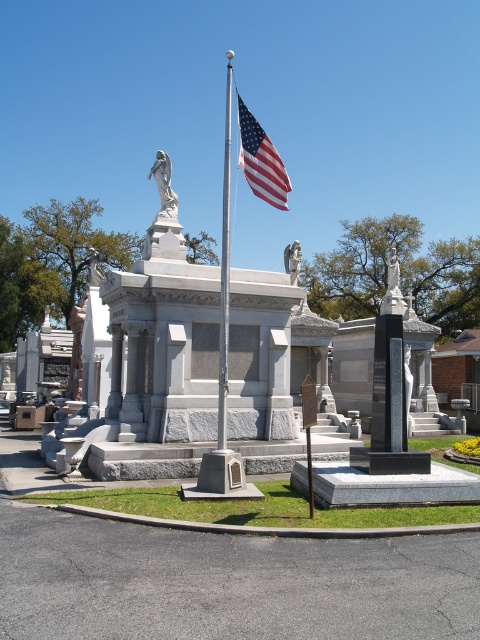
Can you confirm if white marble statue at upper center is positioned to the left of white marble statue at center?

Correct, you'll find white marble statue at upper center to the left of white marble statue at center.

Looking at this image, can you confirm if white marble statue at upper center is shorter than white marble statue at center?

Correct, white marble statue at upper center is not as tall as white marble statue at center.

Does point (169, 168) lie behind point (299, 262)?

No, it is not.

Identify the location of white marble statue at upper center. (164, 186).

Image resolution: width=480 pixels, height=640 pixels. Describe the element at coordinates (225, 272) in the screenshot. I see `polished metal flagpole at center` at that location.

Is polished metal flagpole at center bigger than white marble statue at upper center?

Yes, polished metal flagpole at center is bigger than white marble statue at upper center.

Describe the element at coordinates (225, 272) in the screenshot. I see `polished metal flagpole at center` at that location.

Identify the location of polished metal flagpole at center. (225, 272).

Between polished metal flagpole at center and white marble statue at center, which one has more height?

polished metal flagpole at center

Is point (223, 316) in front of point (292, 268)?

Yes, it is in front of point (292, 268).

Who is more forward, (223, 294) or (284, 262)?

Point (223, 294)

The height and width of the screenshot is (640, 480). What are the coordinates of `polished metal flagpole at center` in the screenshot? It's located at (225, 272).